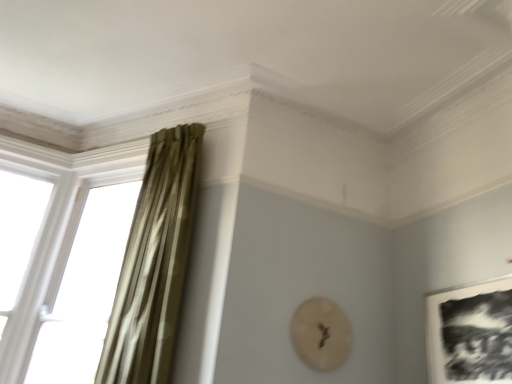
Question: Does translucent glass window at left lie behind black matte picture frame at lower right?

Choices:
 (A) no
 (B) yes

Answer: (B)

Question: Does translucent glass window at left have a smaller size compared to black matte picture frame at lower right?

Choices:
 (A) yes
 (B) no

Answer: (B)

Question: Does translucent glass window at left appear on the left side of black matte picture frame at lower right?

Choices:
 (A) yes
 (B) no

Answer: (A)

Question: Does translucent glass window at left have a lesser width compared to black matte picture frame at lower right?

Choices:
 (A) yes
 (B) no

Answer: (B)

Question: Is translucent glass window at left facing away from black matte picture frame at lower right?

Choices:
 (A) yes
 (B) no

Answer: (B)

Question: From a real-world perspective, relative to translucent glass window at left, is black matte picture frame at lower right vertically above or below?

Choices:
 (A) below
 (B) above

Answer: (A)

Question: Is black matte picture frame at lower right inside or outside of translucent glass window at left?

Choices:
 (A) inside
 (B) outside

Answer: (B)

Question: Relative to translucent glass window at left, is black matte picture frame at lower right in front or behind?

Choices:
 (A) front
 (B) behind

Answer: (A)

Question: Looking at their shapes, would you say black matte picture frame at lower right is wider or thinner than translucent glass window at left?

Choices:
 (A) wide
 (B) thin

Answer: (B)

Question: Considering their positions, is translucent glass window at left located in front of or behind black matte picture frame at lower right?

Choices:
 (A) front
 (B) behind

Answer: (B)

Question: In terms of size, does translucent glass window at left appear bigger or smaller than black matte picture frame at lower right?

Choices:
 (A) big
 (B) small

Answer: (A)

Question: From a real-world perspective, is translucent glass window at left physically located above or below black matte picture frame at lower right?

Choices:
 (A) above
 (B) below

Answer: (A)

Question: Is translucent glass window at left situated inside black matte picture frame at lower right or outside?

Choices:
 (A) inside
 (B) outside

Answer: (B)

Question: In terms of width, does green velvet curtain at left look wider or thinner when compared to black matte picture frame at lower right?

Choices:
 (A) thin
 (B) wide

Answer: (B)

Question: Is green velvet curtain at left spatially inside black matte picture frame at lower right, or outside of it?

Choices:
 (A) inside
 (B) outside

Answer: (B)